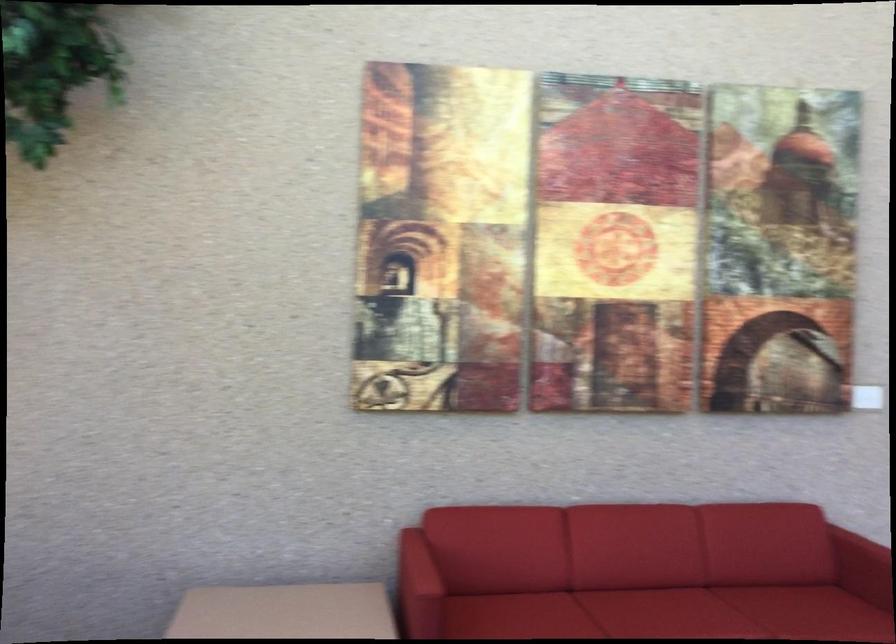
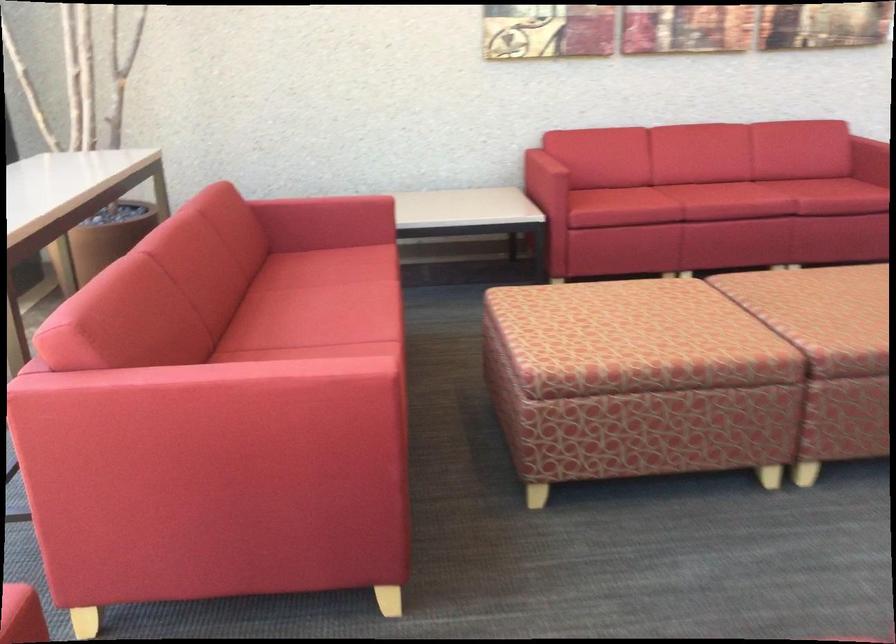
Which direction would the cameraman need to move to produce the second image?

The movement direction of the cameraman is left, backward.